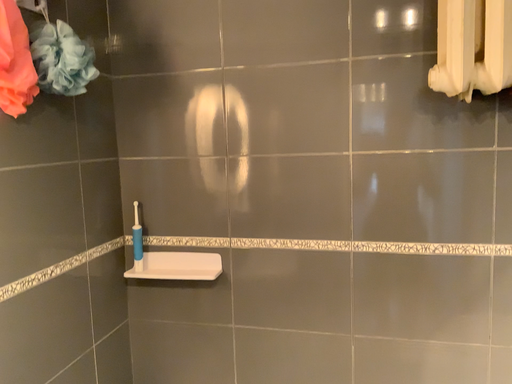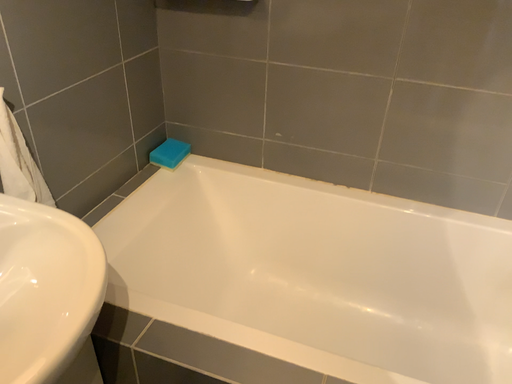
Question: How did the camera likely rotate when shooting the video?

Choices:
 (A) rotated upward
 (B) rotated downward

Answer: (B)